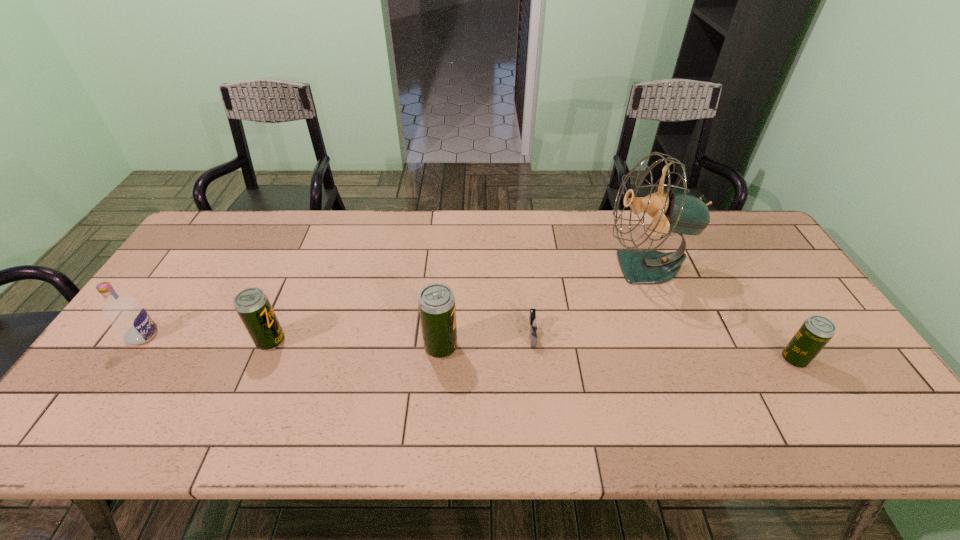
To achieve even spacing by inserting another beer_can among them, please point to a vacant spot for this new beer_can. Please provide its 2D coordinates. Your answer should be formatted as a tuple, i.e. [(x, y)], where the tuple contains the x and y coordinates of a point satisfying the conditions above.

[(615, 353)]